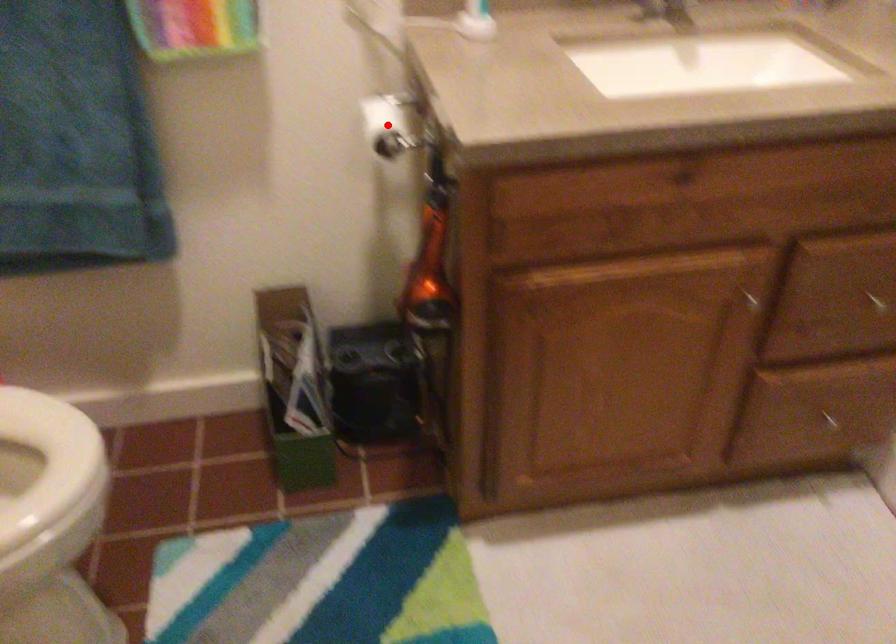
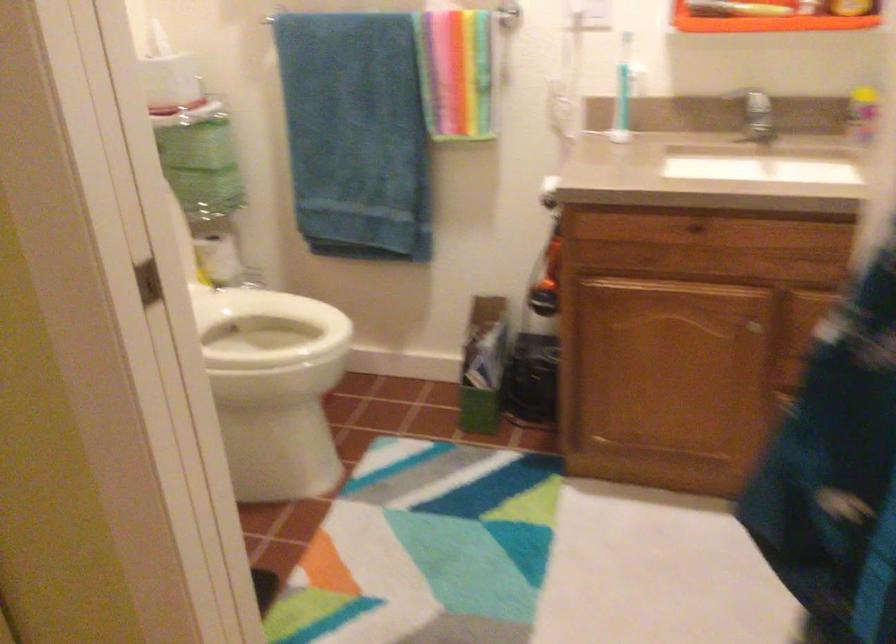
Question: I am providing you with two images of the same scene from different viewpoints. A red point is marked on the first image. Can you still see the location of the red point in image 2?

Choices:
 (A) Yes
 (B) No

Answer: (B)